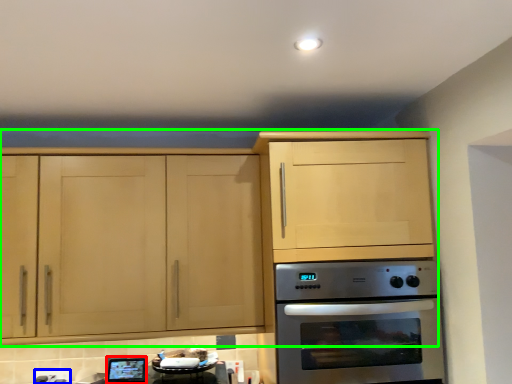
Question: Which is nearer to the appliance (highlighted by a red box)? electric outlet (highlighted by a blue box) or cabinetry (highlighted by a green box).

Choices:
 (A) electric outlet
 (B) cabinetry

Answer: (A)